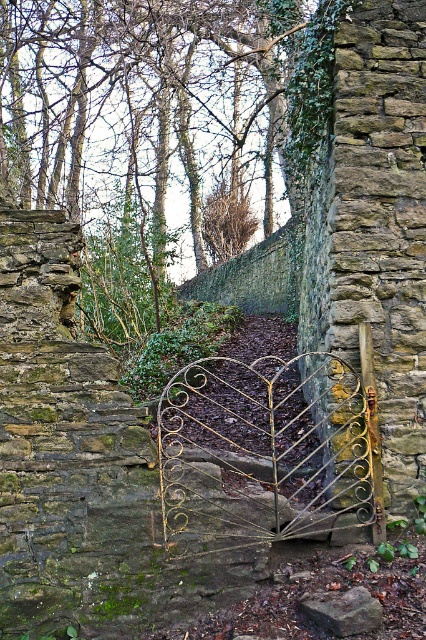
Can you confirm if gold wrought iron gate at center is positioned to the left of brown rough stone at center?

Correct, you'll find gold wrought iron gate at center to the left of brown rough stone at center.

Does gold wrought iron gate at center have a greater height compared to brown rough stone at center?

Indeed, gold wrought iron gate at center has a greater height compared to brown rough stone at center.

You are a GUI agent. You are given a task and a screenshot of the screen. Output one action in this format:
    pyautogui.click(x=<x>, y=<y>)
    Task: Click on the gold wrought iron gate at center
    The image size is (426, 640).
    Given the screenshot: What is the action you would take?
    pyautogui.click(x=268, y=451)